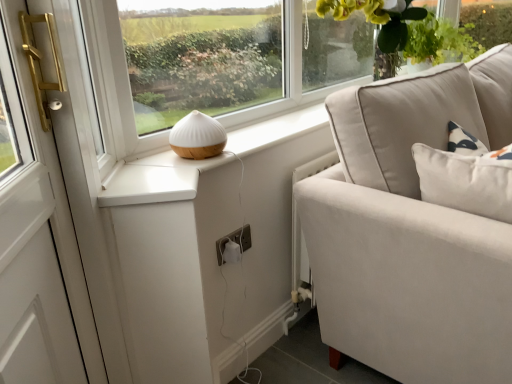
Locate an element on the screen. white matte table lamp at center is located at coordinates (197, 136).

Find the location of a particular element. The image size is (512, 384). green leafy plant at upper right is located at coordinates (440, 41).

Measure the distance between green leafy plant at upper right and camera.

A distance of 6.80 feet exists between green leafy plant at upper right and camera.

I want to click on white matte table lamp at center, so click(197, 136).

In terms of size, does green leafy plant at upper right appear bigger or smaller than white matte table lamp at center?

Considering their sizes, green leafy plant at upper right takes up more space than white matte table lamp at center.

Can you confirm if green leafy plant at upper right is positioned to the left of white matte table lamp at center?

In fact, green leafy plant at upper right is to the right of white matte table lamp at center.

This screenshot has height=384, width=512. Identify the location of table lamp beneath the green leafy plant at upper right (from a real-world perspective). (197, 136).

Relative to white matte table lamp at center, is green leafy plant at upper right in front or behind?

Clearly, green leafy plant at upper right is behind white matte table lamp at center.

Is white plastic electric outlet at lower center in front of or behind green leafy plant at upper right in the image?

white plastic electric outlet at lower center is positioned closer to the viewer than green leafy plant at upper right.

Would you say white plastic electric outlet at lower center contains green leafy plant at upper right?

No.

Is white plastic electric outlet at lower center next to green leafy plant at upper right?

No, white plastic electric outlet at lower center is not next to green leafy plant at upper right.

Can you tell me how much white plastic electric outlet at lower center and green leafy plant at upper right differ in facing direction?

The facing directions of white plastic electric outlet at lower center and green leafy plant at upper right are 0.00265 degrees apart.

What's the angular difference between white matte table lamp at center and white plastic electric outlet at lower center's facing directions?

The angular difference between white matte table lamp at center and white plastic electric outlet at lower center is 0.00404 degrees.

From the image's perspective, is white matte table lamp at center above or below white plastic electric outlet at lower center?

From the image's perspective, white matte table lamp at center appears above white plastic electric outlet at lower center.

Which of these two, white matte table lamp at center or white plastic electric outlet at lower center, is smaller?

white plastic electric outlet at lower center.

Is point (195, 158) positioned behind point (245, 243)?

No.

Is green leafy plant at upper right at the back of white matte table lamp at center?

white matte table lamp at center does not have its back to green leafy plant at upper right.

Looking at this image, considering the sizes of white matte table lamp at center and green leafy plant at upper right in the image, is white matte table lamp at center bigger or smaller than green leafy plant at upper right?

white matte table lamp at center is smaller than green leafy plant at upper right.

Is white matte table lamp at center wider than green leafy plant at upper right?

No.

Can you tell me how much white matte table lamp at center and green leafy plant at upper right differ in facing direction?

0.00142 degrees.

Is white plastic electric outlet at lower center directly adjacent to white matte table lamp at center?

No, white plastic electric outlet at lower center is not with white matte table lamp at center.

What are the coordinates of `table lamp above the white plastic electric outlet at lower center (from the image's perspective)` in the screenshot? It's located at (197, 136).

From a real-world perspective, which object rests below the other?

From a 3D spatial view, white plastic electric outlet at lower center is below.

Does green leafy plant at upper right contain white plastic electric outlet at lower center?

That's incorrect, white plastic electric outlet at lower center is not inside green leafy plant at upper right.

Is point (432, 26) closer or farther from the camera than point (245, 238)?

Point (432, 26).

Is green leafy plant at upper right not near white plastic electric outlet at lower center?

Yes, green leafy plant at upper right is far from white plastic electric outlet at lower center.

The image size is (512, 384). Find the location of `table lamp that appears below the green leafy plant at upper right (from a real-world perspective)`. table lamp that appears below the green leafy plant at upper right (from a real-world perspective) is located at coordinates (197, 136).

The width and height of the screenshot is (512, 384). I want to click on plant located above the white plastic electric outlet at lower center (from a real-world perspective), so click(440, 41).

Which object lies further to the anchor point white matte table lamp at center, white plastic electric outlet at lower center or green leafy plant at upper right?

green leafy plant at upper right.

Looking at the image, which one is located closer to white plastic electric outlet at lower center, white matte table lamp at center or green leafy plant at upper right?

white matte table lamp at center is positioned closer to the anchor white plastic electric outlet at lower center.

Considering their positions, is white matte table lamp at center positioned closer to green leafy plant at upper right than white plastic electric outlet at lower center?

Based on the image, white matte table lamp at center appears to be nearer to green leafy plant at upper right.

Based on their spatial positions, is green leafy plant at upper right or white plastic electric outlet at lower center closer to white matte table lamp at center?

white plastic electric outlet at lower center is positioned closer to the anchor white matte table lamp at center.

Considering their positions, is white plastic electric outlet at lower center positioned closer to green leafy plant at upper right than white matte table lamp at center?

Based on the image, white matte table lamp at center appears to be nearer to green leafy plant at upper right.

Estimate the real-world distances between objects in this image. Which object is further from white plastic electric outlet at lower center, green leafy plant at upper right or white matte table lamp at center?

green leafy plant at upper right is further to white plastic electric outlet at lower center.

The height and width of the screenshot is (384, 512). In order to click on electric outlet between white matte table lamp at center and green leafy plant at upper right in this screenshot , I will do `click(234, 241)`.